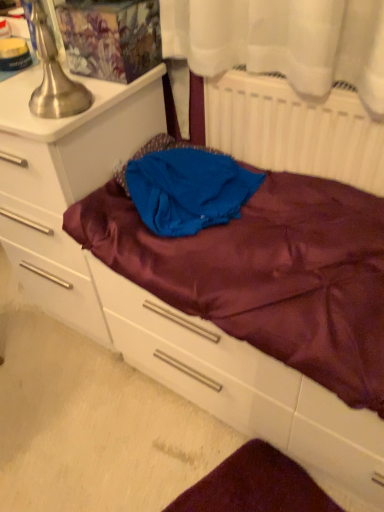
Where is `vacant space situated above white matte radiator at upper right (from a real-world perspective)`? vacant space situated above white matte radiator at upper right (from a real-world perspective) is located at coordinates (288, 75).